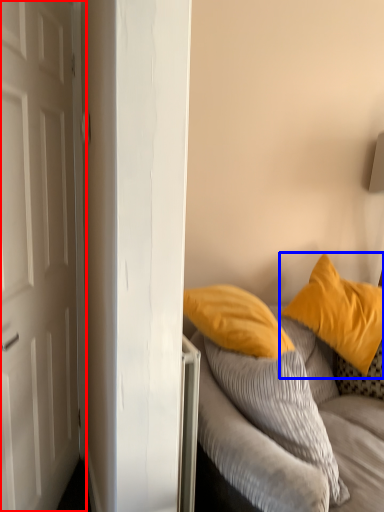
Question: Which object appears farthest to the camera in this image, door (highlighted by a red box) or pillow (highlighted by a blue box)?

Choices:
 (A) door
 (B) pillow

Answer: (B)